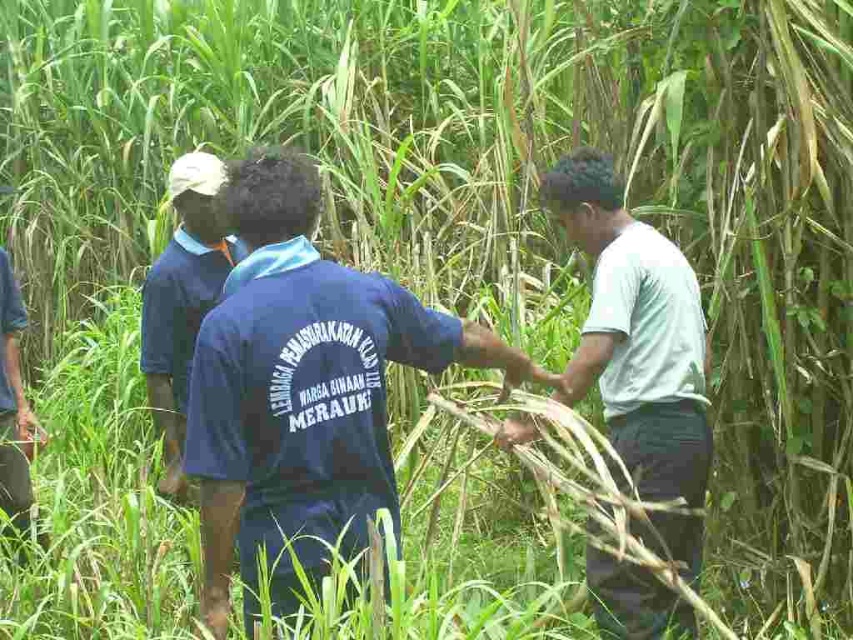
Where is `blue fabric shirt at center`? The image size is (853, 640). blue fabric shirt at center is located at coordinates (302, 388).

Which of these two, blue fabric shirt at center or dark blue shirt at center, stands taller?

With more height is dark blue shirt at center.

Is point (276, 314) in front of point (201, 301)?

That is True.

The width and height of the screenshot is (853, 640). What are the coordinates of `blue fabric shirt at center` in the screenshot? It's located at (302, 388).

Can you confirm if white cotton shirt at right is positioned below dark blue shirt at center?

Yes.

Is point (656, 426) closer to camera compared to point (195, 198)?

Yes, point (656, 426) is in front of point (195, 198).

Where is `white cotton shirt at right`? The height and width of the screenshot is (640, 853). white cotton shirt at right is located at coordinates (636, 332).

Can you confirm if blue fabric shirt at center is positioned to the left of white cotton shirt at right?

Correct, you'll find blue fabric shirt at center to the left of white cotton shirt at right.

Which is above, blue fabric shirt at center or white cotton shirt at right?

Positioned higher is blue fabric shirt at center.

I want to click on blue fabric shirt at center, so click(302, 388).